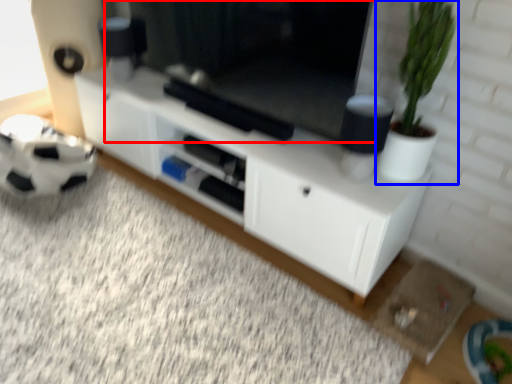
Question: Among these objects, which one is farthest to the camera, window screen (highlighted by a red box) or houseplant (highlighted by a blue box)?

Choices:
 (A) window screen
 (B) houseplant

Answer: (A)